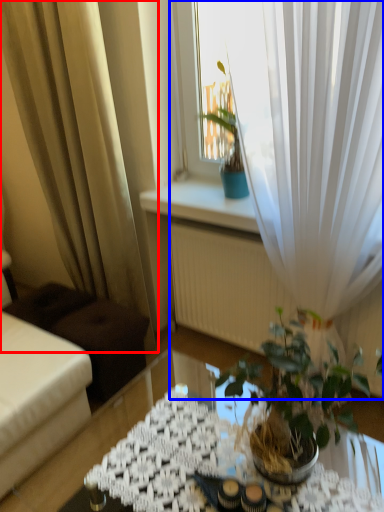
Question: Among these objects, which one is nearest to the camera, curtain (highlighted by a red box) or curtain (highlighted by a blue box)?

Choices:
 (A) curtain
 (B) curtain

Answer: (B)